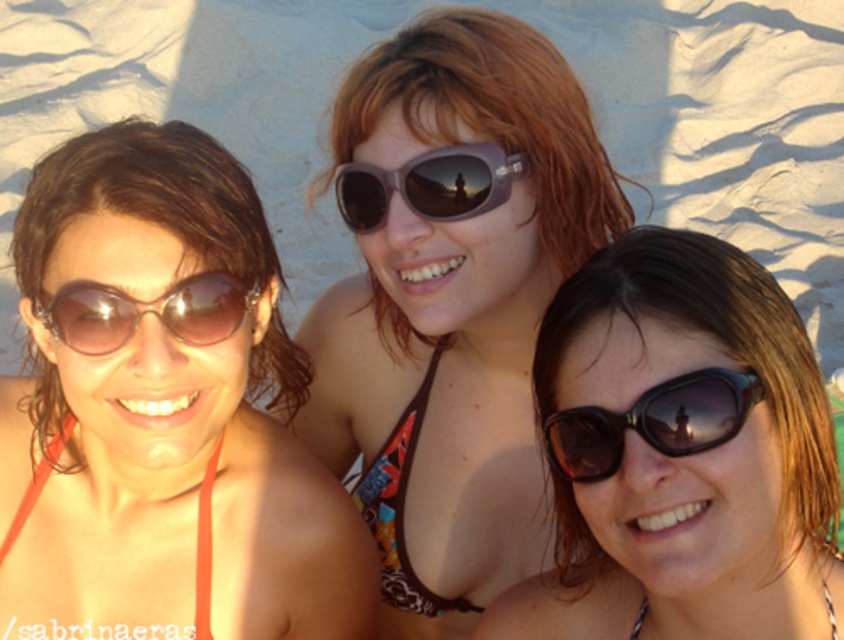
You are a photographer trying to adjust the lighting for a beach photo shoot. You notice the matte orange bikini top at left is casting a shadow at coordinates approximately 0.644, 0.193. Based on the scene description, where should you position the light source to ensure the shadow falls away from the main subjects? Please provide coordinates relative to the image frame.

The light source should be positioned opposite to the shadow cast by the matte orange bikini top at left. Since the shadow is at coordinates [161,412], placing the light source in the direction away from this point would ensure the shadow falls away from the main subjects. For example, positioning the light source near the top left corner of the image frame would cast the shadow downward and to the right, keeping it out of the main subjects.

You are a photographer trying to capture a closeup of the matte brown bikini top at center without including the matte brown sunglasses at left in the frame. Based on their positions, is this possible?

The matte brown bikini top at center is further to the viewer than the matte brown sunglasses at left, so yes, it is possible to capture a closeup of the matte brown bikini top at center without including the matte brown sunglasses at left in the frame.